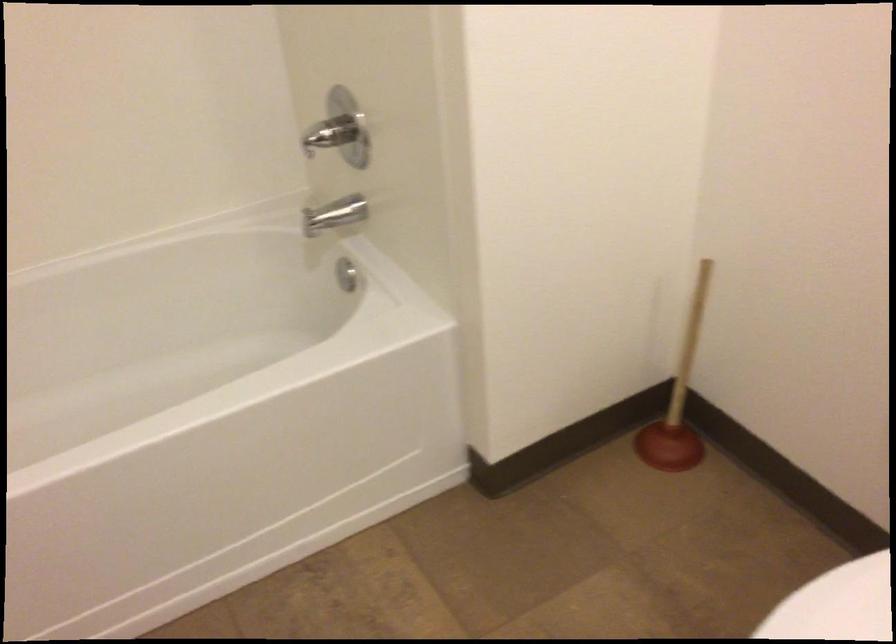
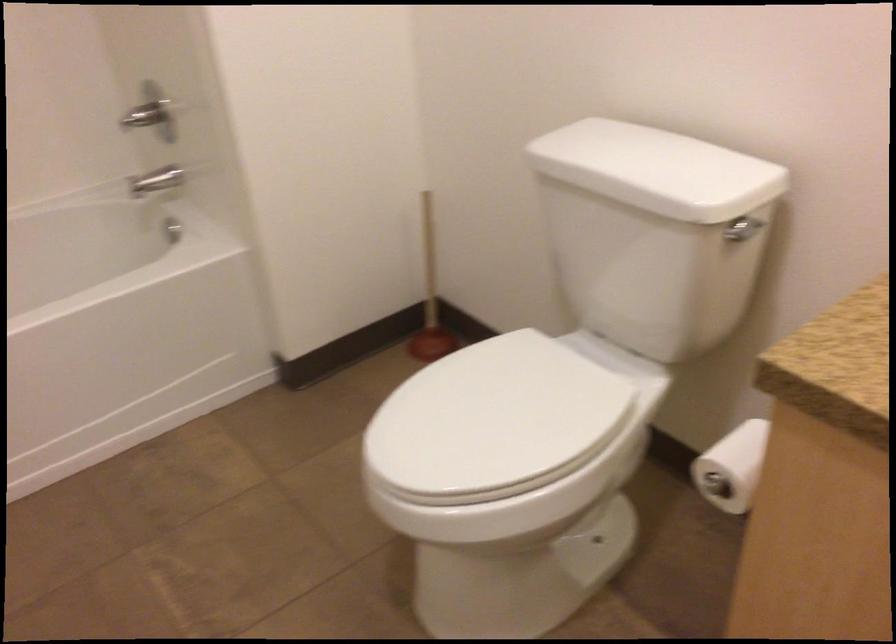
The images are taken continuously from a first-person perspective. In which direction are you moving?

The cameraman moved toward right, backward.